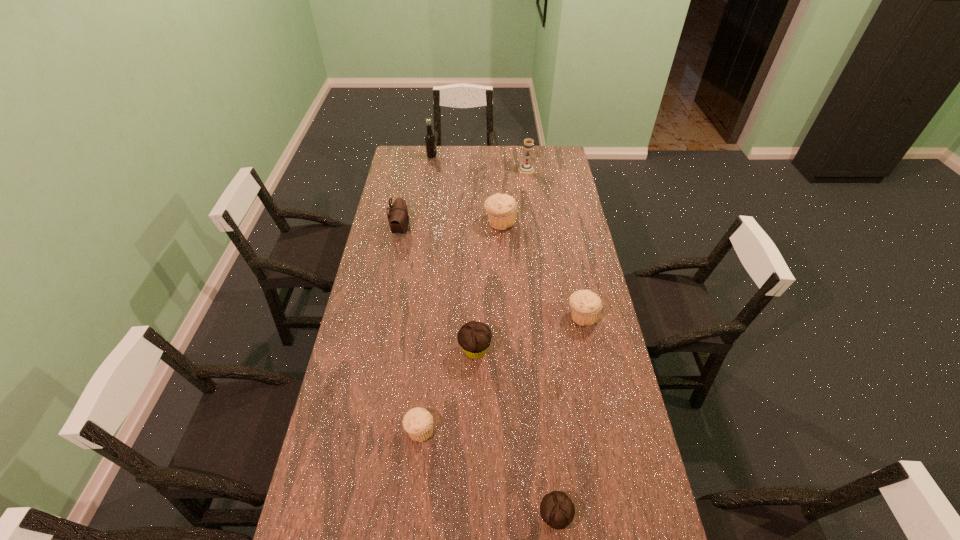
At what (x,y) coordinates should I click in order to perform the action: click on empty location between the smallest beige muffin and the tallest muffin. Please return your answer as a coordinate pair (x, y). The width and height of the screenshot is (960, 540). Looking at the image, I should click on (460, 326).

You are a GUI agent. You are given a task and a screenshot of the screen. Output one action in this format:
    pyautogui.click(x=<x>, y=<y>)
    Task: Click on the free space between the brown pouch and the biggest beige muffin
    The height and width of the screenshot is (540, 960).
    Given the screenshot: What is the action you would take?
    pyautogui.click(x=450, y=226)

Point out which object is positioned as the second nearest to the fifth farthest object. Please provide its 2D coordinates. Your answer should be formatted as a tuple, i.e. [(x, y)], where the tuple contains the x and y coordinates of a point satisfying the conditions above.

[(502, 208)]

The width and height of the screenshot is (960, 540). I want to click on object that is the seventh closest one to the leftmost object, so click(x=557, y=510).

This screenshot has height=540, width=960. Identify the location of the second closest muffin to the smaller chocolate muffin. (474, 337).

Image resolution: width=960 pixels, height=540 pixels. What are the coordinates of `muffin that is the third nearest to the right chocolate muffin` in the screenshot? It's located at point(586,306).

Point out which beige muffin is positioned as the nearest to the third object from left to right. Please provide its 2D coordinates. Your answer should be formatted as a tuple, i.e. [(x, y)], where the tuple contains the x and y coordinates of a point satisfying the conditions above.

[(586, 306)]

The height and width of the screenshot is (540, 960). Find the location of `beige muffin that stands as the second closest to the fourth nearest muffin`. beige muffin that stands as the second closest to the fourth nearest muffin is located at coordinates (418, 422).

This screenshot has height=540, width=960. In order to click on vacant region that satisfies the following two spatial constraints: 1. on the label of the nearest muffin; 2. on the right side of the second object from left to right in this screenshot , I will do `click(380, 517)`.

Where is `vacant position in the image that satisfies the following two spatial constraints: 1. on the label of the smaller chocolate muffin; 2. on the left side of the tallest object`? vacant position in the image that satisfies the following two spatial constraints: 1. on the label of the smaller chocolate muffin; 2. on the left side of the tallest object is located at coordinates (380, 517).